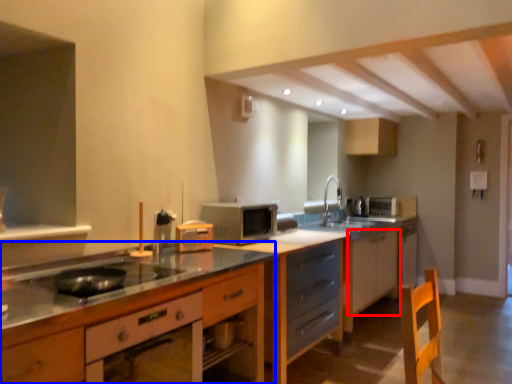
Question: Among these objects, which one is nearest to the camera, cabinetry (highlighted by a red box) or cabinetry (highlighted by a blue box)?

Choices:
 (A) cabinetry
 (B) cabinetry

Answer: (B)